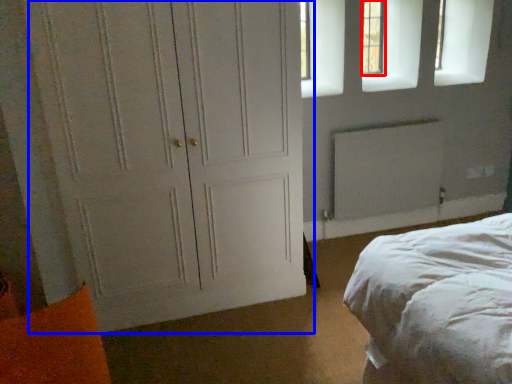
Question: Which point is further to the camera, window (highlighted by a red box) or door (highlighted by a blue box)?

Choices:
 (A) window
 (B) door

Answer: (A)